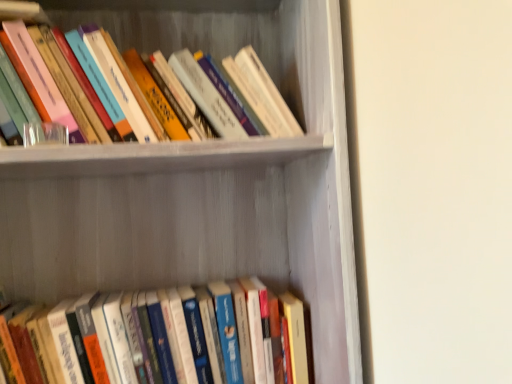
Question: From the image's perspective, is hardcover books at upper left, which ranks as the first book in top-to-bottom order, below hardcover books at lower center, positioned as the 1th book in bottom-to-top order?

Choices:
 (A) no
 (B) yes

Answer: (A)

Question: Is hardcover books at upper left, which ranks as the first book in top-to-bottom order, positioned with its back to hardcover books at lower center, placed as the second book when sorted from top to bottom?

Choices:
 (A) no
 (B) yes

Answer: (A)

Question: Is hardcover books at upper left, which ranks as the first book in top-to-bottom order, to the left of hardcover books at lower center, positioned as the 1th book in bottom-to-top order, from the viewer's perspective?

Choices:
 (A) no
 (B) yes

Answer: (B)

Question: Does hardcover books at upper left, which is the 2th book from bottom to top, have a lesser width compared to hardcover books at lower center, placed as the second book when sorted from top to bottom?

Choices:
 (A) no
 (B) yes

Answer: (A)

Question: From a real-world perspective, is hardcover books at upper left, which is the 2th book from bottom to top, positioned under hardcover books at lower center, placed as the second book when sorted from top to bottom, based on gravity?

Choices:
 (A) no
 (B) yes

Answer: (A)

Question: Can you confirm if hardcover books at upper left, which is the 2th book from bottom to top, is shorter than hardcover books at lower center, positioned as the 1th book in bottom-to-top order?

Choices:
 (A) no
 (B) yes

Answer: (A)

Question: Does white matte bookshelf at upper center touch hardcover books at lower center, positioned as the 1th book in bottom-to-top order?

Choices:
 (A) yes
 (B) no

Answer: (B)

Question: Is the depth of white matte bookshelf at upper center less than that of hardcover books at lower center, positioned as the 1th book in bottom-to-top order?

Choices:
 (A) no
 (B) yes

Answer: (B)

Question: Is white matte bookshelf at upper center not inside hardcover books at lower center, placed as the second book when sorted from top to bottom?

Choices:
 (A) yes
 (B) no

Answer: (A)

Question: Is white matte bookshelf at upper center at the left side of hardcover books at lower center, positioned as the 1th book in bottom-to-top order?

Choices:
 (A) yes
 (B) no

Answer: (B)

Question: Considering the relative sizes of white matte bookshelf at upper center and hardcover books at lower center, positioned as the 1th book in bottom-to-top order, in the image provided, is white matte bookshelf at upper center smaller than hardcover books at lower center, positioned as the 1th book in bottom-to-top order,?

Choices:
 (A) yes
 (B) no

Answer: (B)

Question: From the image's perspective, is white matte bookshelf at upper center beneath hardcover books at lower center, positioned as the 1th book in bottom-to-top order?

Choices:
 (A) yes
 (B) no

Answer: (B)

Question: From the image's perspective, is hardcover books at upper left, which is the 2th book from bottom to top, above white matte bookshelf at upper center?

Choices:
 (A) no
 (B) yes

Answer: (B)